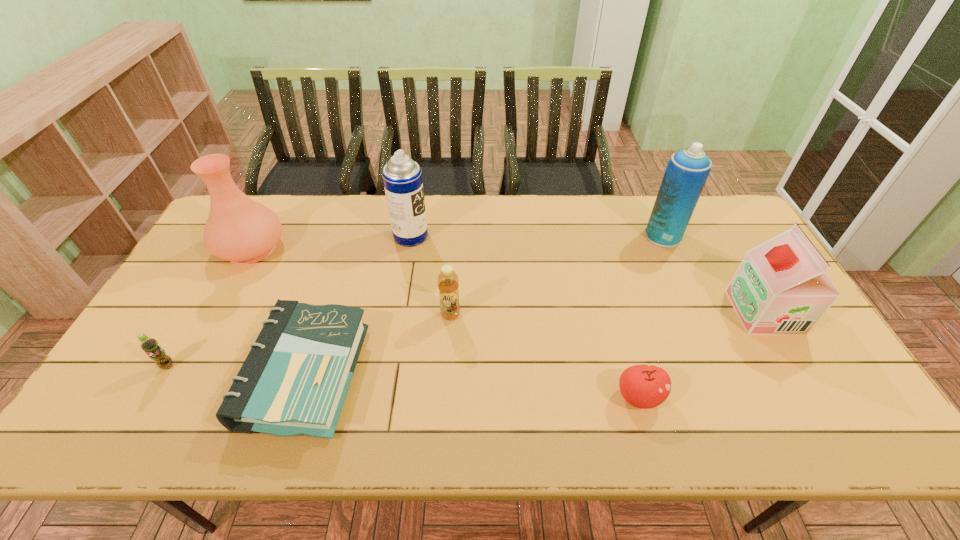
The height and width of the screenshot is (540, 960). Identify the location of blank region between the soda and the vase. (209, 307).

Identify which object is located as the fourth nearest to the rightmost object. Please provide its 2D coordinates. Your answer should be formatted as a tuple, i.e. [(x, y)], where the tuple contains the x and y coordinates of a point satisfying the conditions above.

[(402, 177)]

Select which object is the fifth closest to the vase. Please provide its 2D coordinates. Your answer should be formatted as a tuple, i.e. [(x, y)], where the tuple contains the x and y coordinates of a point satisfying the conditions above.

[(643, 386)]

The image size is (960, 540). In order to click on vacant position in the image that satisfies the following two spatial constraints: 1. with the cap open on the fifth shortest object; 2. on the front label of the soda in this screenshot , I will do `click(796, 366)`.

Locate an element on the screen. This screenshot has height=540, width=960. free spot that satisfies the following two spatial constraints: 1. on the label side of the fifth object from right to left; 2. on the right side of the fourth object from right to left is located at coordinates (397, 314).